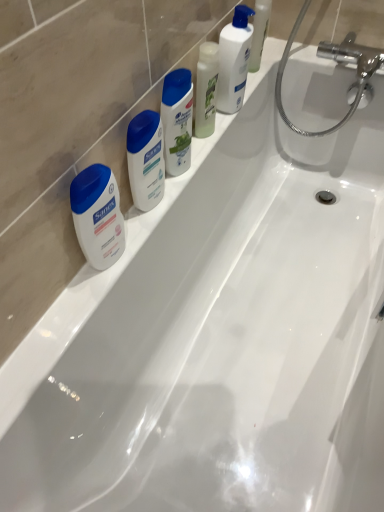
What do you see at coordinates (177, 120) in the screenshot? Image resolution: width=384 pixels, height=512 pixels. I see `white glossy shampoo at center, the 1th cleaning product viewed from the left` at bounding box center [177, 120].

Locate an element on the screen. Image resolution: width=384 pixels, height=512 pixels. translucent plastic bottle at upper center, marked as the second cleaning product in a right-to-left arrangement is located at coordinates (206, 89).

This screenshot has width=384, height=512. What are the coordinates of `white glossy lotion at upper center, which appears as the first cleaning product when viewed from the right` in the screenshot? It's located at (234, 60).

I want to click on white glossy shampoo at center, which is the 3th cleaning product in right-to-left order, so click(x=177, y=120).

Is translucent plastic bottle at upper center, marked as the second cleaning product in a right-to-left arrangement, to the left of matte white lotion at center, placed as the second toiletry when sorted from left to right, from the viewer's perspective?

In fact, translucent plastic bottle at upper center, marked as the second cleaning product in a right-to-left arrangement, is to the right of matte white lotion at center, placed as the second toiletry when sorted from left to right.

Based on the photo, who is smaller, translucent plastic bottle at upper center, marked as the second cleaning product in a right-to-left arrangement, or matte white lotion at center, placed as the second toiletry when sorted from left to right?

With smaller size is translucent plastic bottle at upper center, marked as the second cleaning product in a right-to-left arrangement.

What's the angular difference between translucent plastic bottle at upper center, the 2th cleaning product viewed from the left, and matte white lotion at center, placed as the second toiletry when sorted from left to right,'s facing directions?

0.00347 degrees separate the facing orientations of translucent plastic bottle at upper center, the 2th cleaning product viewed from the left, and matte white lotion at center, placed as the second toiletry when sorted from left to right.

Could you measure the distance between translucent plastic bottle at upper center, marked as the second cleaning product in a right-to-left arrangement, and matte white lotion at center, the 1th toiletry positioned from the right?

The distance of translucent plastic bottle at upper center, marked as the second cleaning product in a right-to-left arrangement, from matte white lotion at center, the 1th toiletry positioned from the right, is 9.76 inches.

Starting from the white glossy lotion at upper center, positioned as the third cleaning product in left-to-right order, which toiletry is the 2nd one to the left? Please provide its 2D coordinates.

[(98, 215)]

From the image's perspective, would you say white matte sanex soap at left, placed as the second toiletry when sorted from right to left, is positioned over white glossy lotion at upper center, which appears as the first cleaning product when viewed from the right?

Incorrect, from the image's perspective, white matte sanex soap at left, placed as the second toiletry when sorted from right to left, is lower than white glossy lotion at upper center, which appears as the first cleaning product when viewed from the right.

What's the angular difference between white matte sanex soap at left, the 1th toiletry when ordered from left to right, and white glossy lotion at upper center, which appears as the first cleaning product when viewed from the right,'s facing directions?

There is a 0.00274-degree angle between the facing directions of white matte sanex soap at left, the 1th toiletry when ordered from left to right, and white glossy lotion at upper center, which appears as the first cleaning product when viewed from the right.

In the scene shown: Relative to white glossy lotion at upper center, which appears as the first cleaning product when viewed from the right, is white matte sanex soap at left, placed as the second toiletry when sorted from right to left, in front or behind?

In the image, white matte sanex soap at left, placed as the second toiletry when sorted from right to left, appears in front of white glossy lotion at upper center, which appears as the first cleaning product when viewed from the right.

Is matte white lotion at center, placed as the second toiletry when sorted from left to right, positioned with its back to white glossy shampoo at center, the 1th cleaning product viewed from the left?

matte white lotion at center, placed as the second toiletry when sorted from left to right, does not have its back to white glossy shampoo at center, the 1th cleaning product viewed from the left.

Is point (141, 190) in front of point (190, 122)?

Yes, it is in front of point (190, 122).

From the image's perspective, which is above, matte white lotion at center, placed as the second toiletry when sorted from left to right, or white glossy shampoo at center, which is the 3th cleaning product in right-to-left order?

From the image's view, white glossy shampoo at center, which is the 3th cleaning product in right-to-left order, is above.

Is matte white lotion at center, the 1th toiletry positioned from the right, to the left or to the right of white glossy shampoo at center, the 1th cleaning product viewed from the left, in the image?

From the image, it's evident that matte white lotion at center, the 1th toiletry positioned from the right, is to the left of white glossy shampoo at center, the 1th cleaning product viewed from the left.

From the image's perspective, which cleaning product is the 2nd one above the white matte sanex soap at left, the 1th toiletry when ordered from left to right? Please provide its 2D coordinates.

[(206, 89)]

In the scene shown: Is white matte sanex soap at left, placed as the second toiletry when sorted from right to left, located within translucent plastic bottle at upper center, marked as the second cleaning product in a right-to-left arrangement?

That's incorrect, white matte sanex soap at left, placed as the second toiletry when sorted from right to left, is not inside translucent plastic bottle at upper center, marked as the second cleaning product in a right-to-left arrangement.

Does translucent plastic bottle at upper center, marked as the second cleaning product in a right-to-left arrangement, turn towards white matte sanex soap at left, the 1th toiletry when ordered from left to right?

No.

From the image's perspective, is translucent plastic bottle at upper center, marked as the second cleaning product in a right-to-left arrangement, located above white matte sanex soap at left, placed as the second toiletry when sorted from right to left?

Yes, from the image's perspective, translucent plastic bottle at upper center, marked as the second cleaning product in a right-to-left arrangement, is above white matte sanex soap at left, placed as the second toiletry when sorted from right to left.

Does white glossy shampoo at center, the 1th cleaning product viewed from the left, have a greater height compared to white glossy lotion at upper center, positioned as the third cleaning product in left-to-right order?

No.

Which object is wider, white glossy shampoo at center, which is the 3th cleaning product in right-to-left order, or white glossy lotion at upper center, which appears as the first cleaning product when viewed from the right?

white glossy lotion at upper center, which appears as the first cleaning product when viewed from the right, is wider.

Which is more to the right, white glossy shampoo at center, the 1th cleaning product viewed from the left, or white glossy lotion at upper center, positioned as the third cleaning product in left-to-right order?

white glossy lotion at upper center, positioned as the third cleaning product in left-to-right order.

Which object is further away from the camera, white glossy shampoo at center, the 1th cleaning product viewed from the left, or white glossy lotion at upper center, which appears as the first cleaning product when viewed from the right?

white glossy lotion at upper center, which appears as the first cleaning product when viewed from the right, is more distant.

Looking at their sizes, would you say translucent plastic bottle at upper center, the 2th cleaning product viewed from the left, is wider or thinner than white glossy shampoo at center, the 1th cleaning product viewed from the left?

Considering their sizes, translucent plastic bottle at upper center, the 2th cleaning product viewed from the left, looks slimmer than white glossy shampoo at center, the 1th cleaning product viewed from the left.

Which object is closer to the camera, translucent plastic bottle at upper center, marked as the second cleaning product in a right-to-left arrangement, or white glossy shampoo at center, the 1th cleaning product viewed from the left?

Positioned in front is white glossy shampoo at center, the 1th cleaning product viewed from the left.

From the image's perspective, between translucent plastic bottle at upper center, the 2th cleaning product viewed from the left, and white glossy shampoo at center, which is the 3th cleaning product in right-to-left order, who is located below?

white glossy shampoo at center, which is the 3th cleaning product in right-to-left order, appears lower in the image.

Is matte white lotion at center, the 1th toiletry positioned from the right, touching white glossy lotion at upper center, which appears as the first cleaning product when viewed from the right?

They are not placed beside each other.

From the image's perspective, is matte white lotion at center, placed as the second toiletry when sorted from left to right, above white glossy lotion at upper center, which appears as the first cleaning product when viewed from the right?

No.

Would you say matte white lotion at center, placed as the second toiletry when sorted from left to right, is inside or outside white glossy lotion at upper center, positioned as the third cleaning product in left-to-right order?

matte white lotion at center, placed as the second toiletry when sorted from left to right, is located beyond the bounds of white glossy lotion at upper center, positioned as the third cleaning product in left-to-right order.

Which cleaning product is the 2nd one when counting from the back of the matte white lotion at center, placed as the second toiletry when sorted from left to right? Please provide its 2D coordinates.

[(206, 89)]

Locate an element on the screen. This screenshot has height=512, width=384. the 3rd cleaning product to the right of the white matte sanex soap at left, the 1th toiletry when ordered from left to right, counting from the anchor's position is located at coordinates (234, 60).

Considering their positions, is white glossy shampoo at center, which is the 3th cleaning product in right-to-left order, positioned further to white glossy lotion at upper center, which appears as the first cleaning product when viewed from the right, than matte white lotion at center, the 1th toiletry positioned from the right?

Based on the image, matte white lotion at center, the 1th toiletry positioned from the right, appears to be further to white glossy lotion at upper center, which appears as the first cleaning product when viewed from the right.

Based on their spatial positions, is white glossy lotion at upper center, which appears as the first cleaning product when viewed from the right, or white matte sanex soap at left, placed as the second toiletry when sorted from right to left, further from white glossy shampoo at center, the 1th cleaning product viewed from the left?

white matte sanex soap at left, placed as the second toiletry when sorted from right to left, lies further to white glossy shampoo at center, the 1th cleaning product viewed from the left, than the other object.

Which object lies further to the anchor point white glossy lotion at upper center, positioned as the third cleaning product in left-to-right order, matte white lotion at center, the 1th toiletry positioned from the right, or translucent plastic bottle at upper center, marked as the second cleaning product in a right-to-left arrangement?

matte white lotion at center, the 1th toiletry positioned from the right, is further to white glossy lotion at upper center, positioned as the third cleaning product in left-to-right order.

Looking at the image, which one is located further to matte white lotion at center, placed as the second toiletry when sorted from left to right, white glossy shampoo at center, which is the 3th cleaning product in right-to-left order, or translucent plastic bottle at upper center, marked as the second cleaning product in a right-to-left arrangement?

translucent plastic bottle at upper center, marked as the second cleaning product in a right-to-left arrangement, is positioned further to the anchor matte white lotion at center, placed as the second toiletry when sorted from left to right.

Based on their spatial positions, is white glossy shampoo at center, the 1th cleaning product viewed from the left, or white glossy lotion at upper center, which appears as the first cleaning product when viewed from the right, further from white matte sanex soap at left, the 1th toiletry when ordered from left to right?

white glossy lotion at upper center, which appears as the first cleaning product when viewed from the right, is positioned further to the anchor white matte sanex soap at left, the 1th toiletry when ordered from left to right.

Estimate the real-world distances between objects in this image. Which object is closer to white matte sanex soap at left, placed as the second toiletry when sorted from right to left, matte white lotion at center, placed as the second toiletry when sorted from left to right, or translucent plastic bottle at upper center, the 2th cleaning product viewed from the left?

The object closer to white matte sanex soap at left, placed as the second toiletry when sorted from right to left, is matte white lotion at center, placed as the second toiletry when sorted from left to right.

From the image, which object appears to be nearer to white glossy lotion at upper center, positioned as the third cleaning product in left-to-right order, white matte sanex soap at left, the 1th toiletry when ordered from left to right, or translucent plastic bottle at upper center, the 2th cleaning product viewed from the left?

translucent plastic bottle at upper center, the 2th cleaning product viewed from the left, lies closer to white glossy lotion at upper center, positioned as the third cleaning product in left-to-right order, than the other object.

Considering their positions, is white glossy lotion at upper center, positioned as the third cleaning product in left-to-right order, positioned closer to matte white lotion at center, placed as the second toiletry when sorted from left to right, than white matte sanex soap at left, placed as the second toiletry when sorted from right to left?

The object closer to matte white lotion at center, placed as the second toiletry when sorted from left to right, is white matte sanex soap at left, placed as the second toiletry when sorted from right to left.

Locate an element on the screen. Image resolution: width=384 pixels, height=512 pixels. cleaning product between translucent plastic bottle at upper center, marked as the second cleaning product in a right-to-left arrangement, and matte white lotion at center, placed as the second toiletry when sorted from left to right, vertically is located at coordinates (177, 120).

Image resolution: width=384 pixels, height=512 pixels. Find the location of `cleaning product between translucent plastic bottle at upper center, marked as the second cleaning product in a right-to-left arrangement, and white matte sanex soap at left, the 1th toiletry when ordered from left to right, in the up-down direction`. cleaning product between translucent plastic bottle at upper center, marked as the second cleaning product in a right-to-left arrangement, and white matte sanex soap at left, the 1th toiletry when ordered from left to right, in the up-down direction is located at coordinates coord(177,120).

Locate an element on the screen. cleaning product between white glossy lotion at upper center, which appears as the first cleaning product when viewed from the right, and white glossy shampoo at center, the 1th cleaning product viewed from the left, from top to bottom is located at coordinates (206, 89).

The width and height of the screenshot is (384, 512). What are the coordinates of `toiletry between white glossy lotion at upper center, positioned as the third cleaning product in left-to-right order, and white matte sanex soap at left, the 1th toiletry when ordered from left to right, in the vertical direction` in the screenshot? It's located at (146, 159).